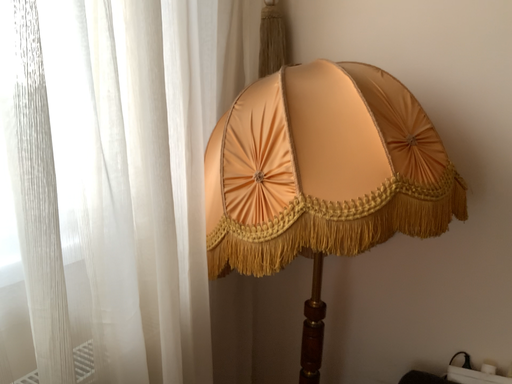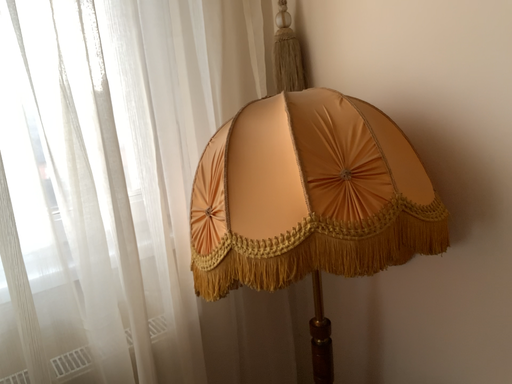
Question: How did the camera likely rotate when shooting the video?

Choices:
 (A) rotated right
 (B) rotated left

Answer: (B)